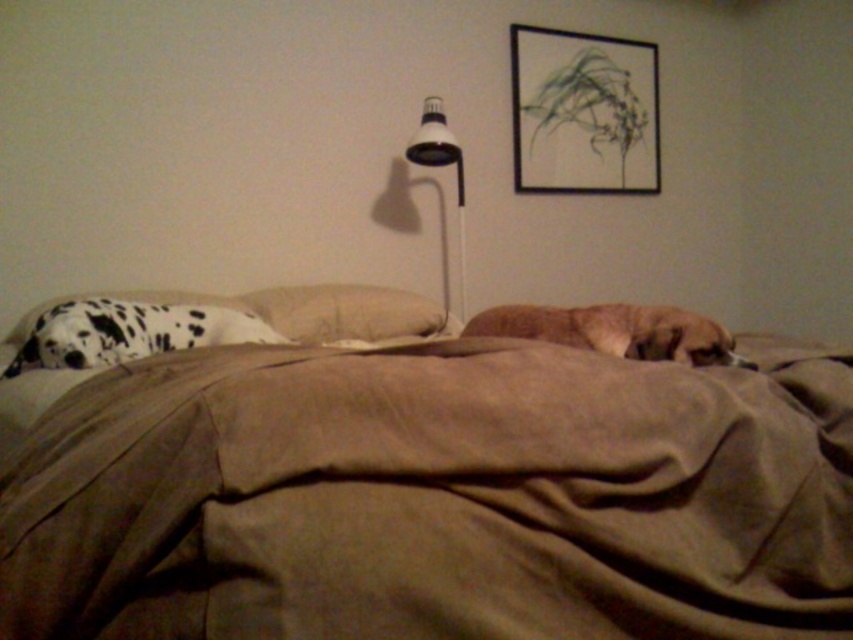
You are trying to decide if the brown fur dog at center can fit on the beige cotton pillow at center. Based on their sizes, what do you think?

The brown fur dog at center is narrower than the beige cotton pillow at center, so it can fit on the pillow.

You are standing in the bedroom and want to place a small plant between the two points, point (573, 524) and point (422, 157). Which point should the plant be closer to so it is in front of the other point?

The plant should be closer to point (573, 524) because it is in front of point (422, 157).

You are a dog owner who wants to place a new toy between the brown fur dog at center and the beige cotton pillow at center. The toy requires 30 inches of space to fit. Is there enough space between them?

The distance between the brown fur dog at center and the beige cotton pillow at center is 29.28 inches, which is slightly less than the required 30 inches. Therefore, there isn not enough space to fit the toy between them.